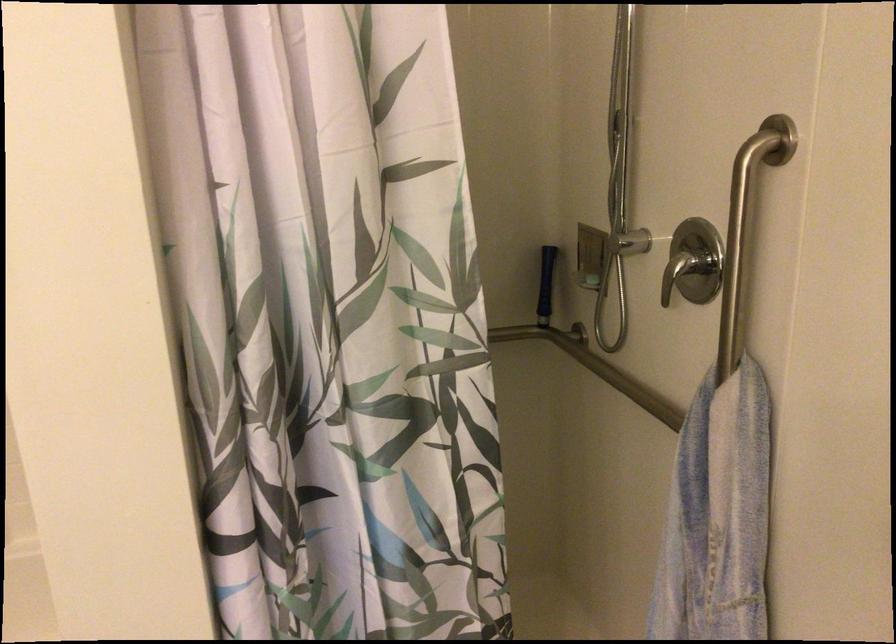
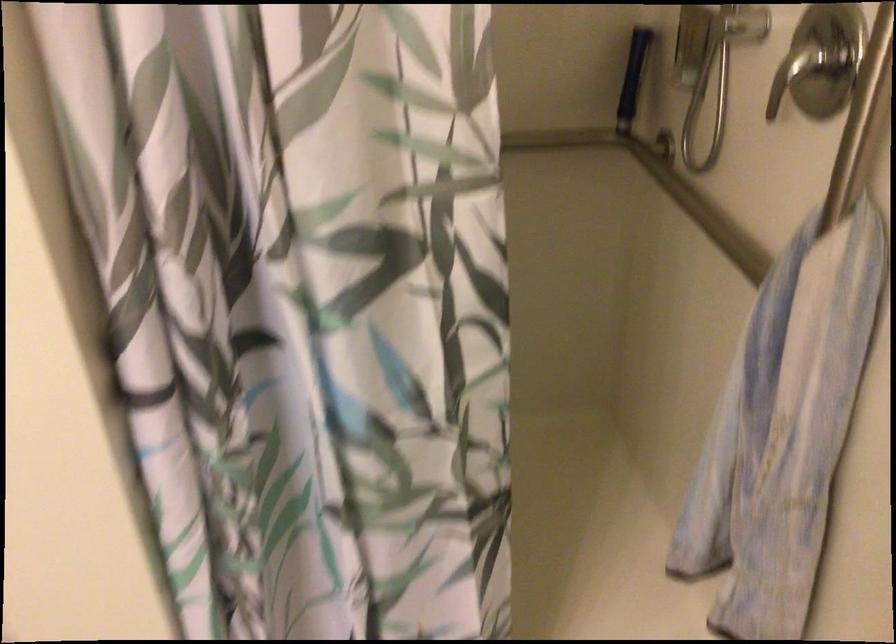
The images are taken continuously from a first-person perspective. In which direction are you moving?

The cameraman walked toward right, forward.